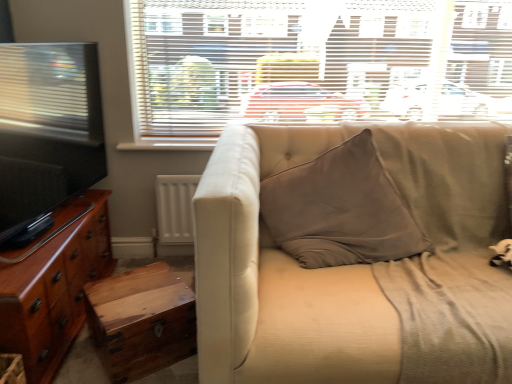
Describe the element at coordinates (335, 267) in the screenshot. I see `beige fabric couch at center` at that location.

In order to click on beige fabric couch at center in this screenshot , I will do `click(335, 267)`.

Which is in front, glossy wood cabinet at left or white textured blinds at upper center?

glossy wood cabinet at left.

Can white textured blinds at upper center be found inside glossy wood cabinet at left?

No, white textured blinds at upper center is located outside of glossy wood cabinet at left.

Which object is positioned more to the left, glossy wood cabinet at left or white textured blinds at upper center?

Positioned to the left is glossy wood cabinet at left.

What are the coordinates of `studio couch beneath the white textured blinds at upper center (from a real-world perspective)` in the screenshot? It's located at (335, 267).

Considering the points (377, 83) and (263, 128), which point is in front, point (377, 83) or point (263, 128)?

The point (263, 128) is closer.

Are white textured blinds at upper center and beige fabric couch at center located far from each other?

No, white textured blinds at upper center is not far from beige fabric couch at center.

Which object is further away from the camera, white textured blinds at upper center or beige fabric couch at center?

white textured blinds at upper center.

Which of these two, white textured blinds at upper center or glossy wood cabinet at left, is smaller?

Smaller between the two is white textured blinds at upper center.

Where is `window on the right side of glossy wood cabinet at left`? The width and height of the screenshot is (512, 384). window on the right side of glossy wood cabinet at left is located at coordinates (314, 63).

Does white textured blinds at upper center touch glossy wood cabinet at left?

white textured blinds at upper center is not next to glossy wood cabinet at left, and they're not touching.

Can wooden trunk at lower left be found inside glossy wood cabinet at left?

No, glossy wood cabinet at left does not contain wooden trunk at lower left.

Considering the relative sizes of glossy wood cabinet at left and wooden trunk at lower left in the image provided, is glossy wood cabinet at left bigger than wooden trunk at lower left?

Correct, glossy wood cabinet at left is larger in size than wooden trunk at lower left.

Is glossy wood cabinet at left looking in the opposite direction of wooden trunk at lower left?

No, glossy wood cabinet at left is not facing the opposite direction of wooden trunk at lower left.

In terms of height, does glossy wood cabinet at left look taller or shorter compared to wooden trunk at lower left?

In the image, glossy wood cabinet at left appears to be taller than wooden trunk at lower left.

Is beige fabric couch at center next to wooden trunk at lower left and touching it?

No, beige fabric couch at center is not beside wooden trunk at lower left.

Between point (267, 367) and point (90, 313), which one is positioned in front?

Positioned in front is point (267, 367).

From the image's perspective, is beige fabric couch at center located beneath wooden trunk at lower left?

Incorrect, from the image's perspective, beige fabric couch at center is higher than wooden trunk at lower left.

Can you confirm if beige fabric couch at center is positioned to the left of wooden trunk at lower left?

No.

Considering the positions of points (190, 140) and (160, 350), is point (190, 140) closer to camera compared to point (160, 350)?

No, (190, 140) is behind (160, 350).

You are a GUI agent. You are given a task and a screenshot of the screen. Output one action in this format:
    pyautogui.click(x=<x>, y=<y>)
    Task: Click on the window behind the wooden trunk at lower left
    
    Given the screenshot: What is the action you would take?
    pyautogui.click(x=314, y=63)

Is white textured blinds at upper center completely or partially outside of wooden trunk at lower left?

Absolutely, white textured blinds at upper center is external to wooden trunk at lower left.

Is white textured blinds at upper center wider or thinner than wooden trunk at lower left?

Considering their sizes, white textured blinds at upper center looks slimmer than wooden trunk at lower left.

From a real-world perspective, who is located lower, wooden trunk at lower left or white textured blinds at upper center?

wooden trunk at lower left.

Considering the relative sizes of wooden trunk at lower left and white textured blinds at upper center in the image provided, is wooden trunk at lower left bigger than white textured blinds at upper center?

No, wooden trunk at lower left is not bigger than white textured blinds at upper center.

How different are the orientations of wooden trunk at lower left and white textured blinds at upper center in degrees?

The angular difference between wooden trunk at lower left and white textured blinds at upper center is 31.8 degrees.

Between point (140, 313) and point (173, 23), which one is positioned in front?

The point (140, 313) is closer.

I want to click on cabinetry that appears below the white textured blinds at upper center (from the image's perspective), so click(54, 287).

Locate an element on the screen. This screenshot has height=384, width=512. window above the beige fabric couch at center (from the image's perspective) is located at coordinates (314, 63).

Estimate the real-world distances between objects in this image. Which object is closer to beige fabric couch at center, glossy wood cabinet at left or white textured blinds at upper center?

The object closer to beige fabric couch at center is white textured blinds at upper center.

Looking at the image, which one is located closer to glossy wood cabinet at left, white textured blinds at upper center or beige fabric couch at center?

beige fabric couch at center is positioned closer to the anchor glossy wood cabinet at left.

When comparing their distances from wooden trunk at lower left, does glossy wood cabinet at left or white textured blinds at upper center seem closer?

Based on the image, glossy wood cabinet at left appears to be nearer to wooden trunk at lower left.

When comparing their distances from glossy wood cabinet at left, does beige fabric couch at center or wooden trunk at lower left seem further?

Among the two, beige fabric couch at center is located further to glossy wood cabinet at left.

From the image, which object appears to be nearer to white textured blinds at upper center, beige fabric couch at center or glossy wood cabinet at left?

beige fabric couch at center is positioned closer to the anchor white textured blinds at upper center.

Based on their spatial positions, is white textured blinds at upper center or glossy wood cabinet at left further from beige fabric couch at center?

glossy wood cabinet at left is further to beige fabric couch at center.

Considering their positions, is beige fabric couch at center positioned closer to wooden trunk at lower left than white textured blinds at upper center?

beige fabric couch at center is positioned closer to the anchor wooden trunk at lower left.

When comparing their distances from glossy wood cabinet at left, does wooden trunk at lower left or white textured blinds at upper center seem closer?

The object closer to glossy wood cabinet at left is wooden trunk at lower left.

This screenshot has width=512, height=384. Find the location of `window located between glossy wood cabinet at left and beige fabric couch at center in the left-right direction`. window located between glossy wood cabinet at left and beige fabric couch at center in the left-right direction is located at coordinates (314, 63).

At what (x,y) coordinates should I click in order to perform the action: click on table between glossy wood cabinet at left and white textured blinds at upper center. Please return your answer as a coordinate pair (x, y). This screenshot has height=384, width=512. Looking at the image, I should click on pyautogui.click(x=142, y=320).

I want to click on window between wooden trunk at lower left and beige fabric couch at center in the horizontal direction, so click(314, 63).

Image resolution: width=512 pixels, height=384 pixels. Identify the location of table situated between glossy wood cabinet at left and beige fabric couch at center from left to right. (142, 320).